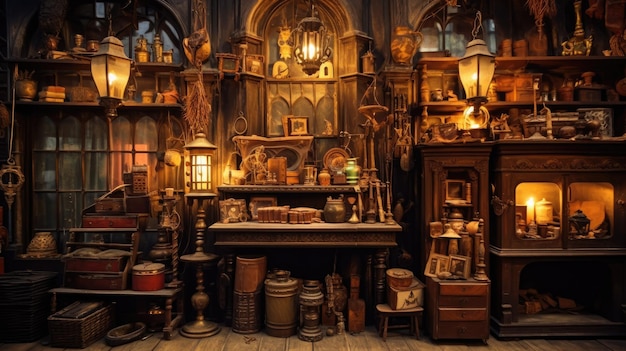
Locate an element on the screen. The width and height of the screenshot is (626, 351). bureau is located at coordinates (444, 286), (448, 313).